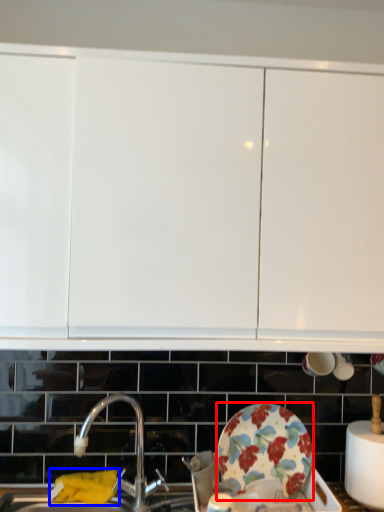
Question: Which object is further to the camera taking this photo, plate (highlighted by a red box) or material (highlighted by a blue box)?

Choices:
 (A) plate
 (B) material

Answer: (B)